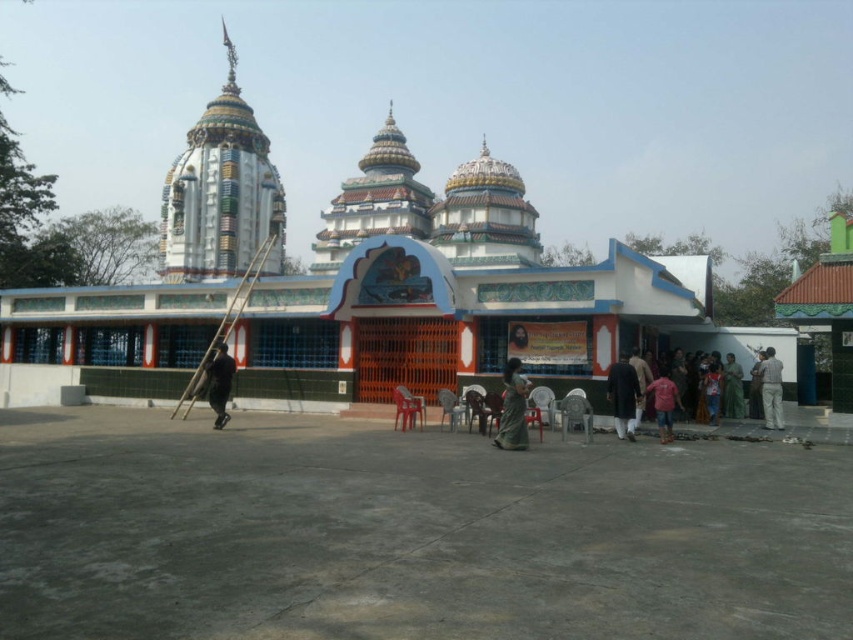
Between dark brown fabric at center and green fabric statue at lower right, which one has less height?

green fabric statue at lower right

Does dark brown fabric at center have a smaller size compared to green fabric statue at lower right?

Actually, dark brown fabric at center might be larger than green fabric statue at lower right.

Find the location of `dark brown fabric at center`. dark brown fabric at center is located at coordinates (624, 396).

Image resolution: width=853 pixels, height=640 pixels. What are the coordinates of `dark brown fabric at center` in the screenshot? It's located at (624, 396).

Does dark blue fabric at center come in front of white cotton shirt at right?

Yes, dark blue fabric at center is in front of white cotton shirt at right.

Between dark blue fabric at center and white cotton shirt at right, which one is positioned higher?

white cotton shirt at right

Is point (218, 372) positioned before point (776, 428)?

No, (218, 372) is behind (776, 428).

Locate an element on the screen. This screenshot has height=640, width=853. dark blue fabric at center is located at coordinates coord(218,381).

Does white cotton shirt at right have a lesser width compared to pink fabric at lower center?

In fact, white cotton shirt at right might be wider than pink fabric at lower center.

Where is `white cotton shirt at right`? The width and height of the screenshot is (853, 640). white cotton shirt at right is located at coordinates (x=770, y=388).

Identify the location of white cotton shirt at right. Image resolution: width=853 pixels, height=640 pixels. (770, 388).